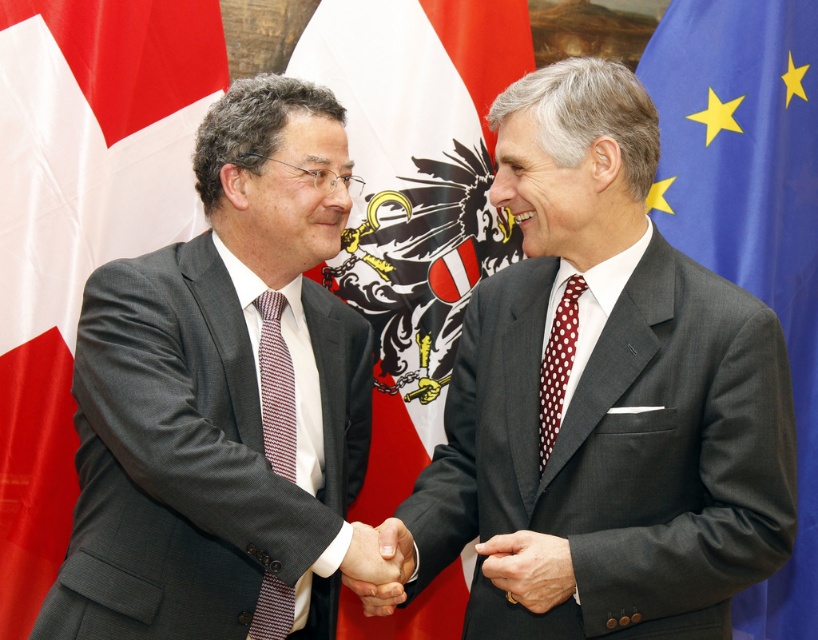
You are a photographer at the event and need to place a new flag exactly 0.1 units to the right of the blue fabric flag at right. What coordinate would you use for the new flag?

The blue fabric flag at right is at point (749, 214). Adding 0.1 to the x coordinate gives 0.436, so the new flag should be placed at coordinate (749, 278).